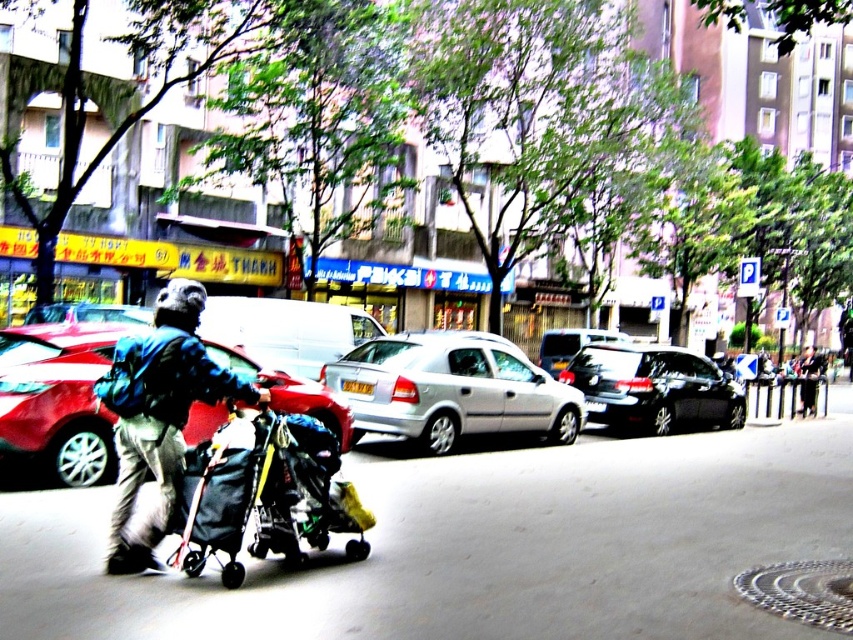
Where is `metallic silver car at center`? The width and height of the screenshot is (853, 640). metallic silver car at center is located at coordinates (57, 397).

Does metallic silver car at center appear under shiny black sedan at center?

No, metallic silver car at center is not below shiny black sedan at center.

In the scene shown: Who is more forward, (103, 323) or (672, 349)?

Point (103, 323) is more forward.

Where is `metallic silver car at center`? The image size is (853, 640). metallic silver car at center is located at coordinates (57, 397).

Is dark gray fabric stroller at center-left below shiny black sedan at center?

Incorrect, dark gray fabric stroller at center-left is not positioned below shiny black sedan at center.

Based on the photo, can you confirm if dark gray fabric stroller at center-left is positioned to the right of shiny black sedan at center?

In fact, dark gray fabric stroller at center-left is to the left of shiny black sedan at center.

Who is more forward, (x=287, y=460) or (x=737, y=406)?

Point (x=287, y=460)

Locate an element on the screen. This screenshot has height=640, width=853. dark gray fabric stroller at center-left is located at coordinates (263, 493).

Is dark gray fabric stroller at center-left thinner than metallic silver car at center?

Yes.

Is dark gray fabric stroller at center-left positioned behind metallic silver car at center?

No, dark gray fabric stroller at center-left is closer to the viewer.

Is point (274, 496) positioned behind point (96, 364)?

No, (274, 496) is in front of (96, 364).

At what (x,y) coordinates should I click in order to perform the action: click on dark gray fabric stroller at center-left. Please return your answer as a coordinate pair (x, y). This screenshot has height=640, width=853. Looking at the image, I should click on (263, 493).